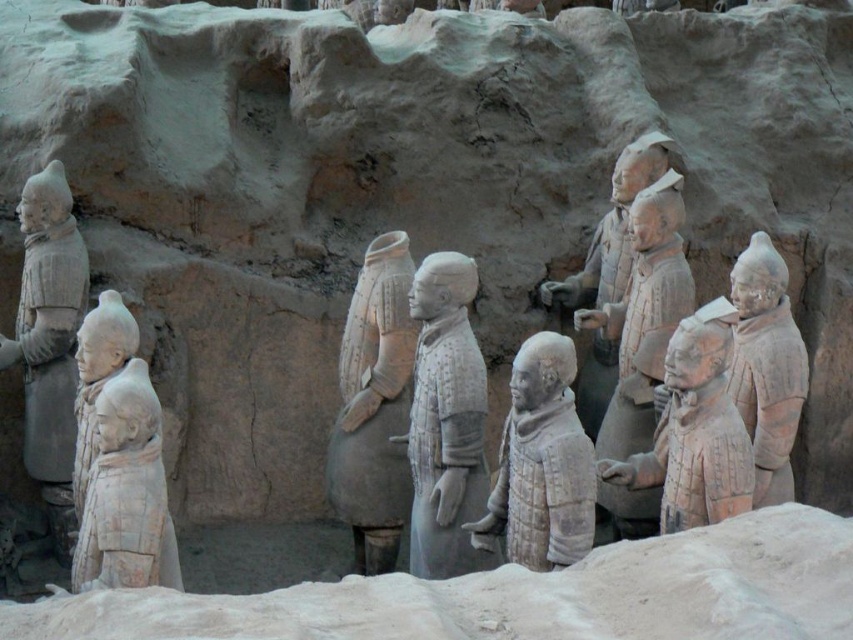
Who is more distant from viewer, [105,413] or [796,412]?

The point [796,412] is behind.

Is point (131, 566) positioned before point (775, 380)?

Yes, point (131, 566) is closer to viewer.

At what (x,y) coordinates should I click in order to perform the action: click on white matte terracotta warrior at center. Please return your answer as a coordinate pair (x, y). This screenshot has height=640, width=853. Looking at the image, I should click on (126, 492).

Which of these two, white textured armor at center or earthenware warrior at right, stands taller?

With more height is earthenware warrior at right.

Is white textured armor at center bigger than earthenware warrior at right?

Indeed, white textured armor at center has a larger size compared to earthenware warrior at right.

Image resolution: width=853 pixels, height=640 pixels. What do you see at coordinates (695, 429) in the screenshot?
I see `white textured armor at center` at bounding box center [695, 429].

Locate an element on the screen. white textured armor at center is located at coordinates (695, 429).

This screenshot has width=853, height=640. What do you see at coordinates (374, 406) in the screenshot?
I see `earthenware armor at center` at bounding box center [374, 406].

Is earthenware armor at center above earthenware warrior at right?

No, earthenware armor at center is not above earthenware warrior at right.

Is point (344, 358) positioned in front of point (772, 305)?

No, it is behind (772, 305).

You are a GUI agent. You are given a task and a screenshot of the screen. Output one action in this format:
    pyautogui.click(x=<x>, y=<y>)
    Task: Click on the earthenware armor at center
    
    Given the screenshot: What is the action you would take?
    pyautogui.click(x=374, y=406)